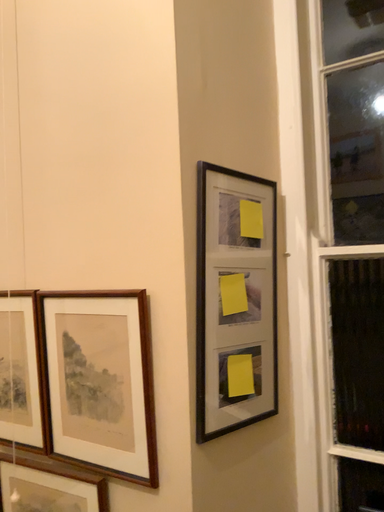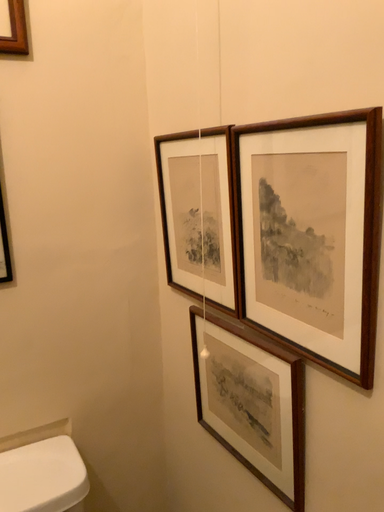
Question: Which way did the camera rotate in the video?

Choices:
 (A) rotated upward
 (B) rotated downward

Answer: (B)